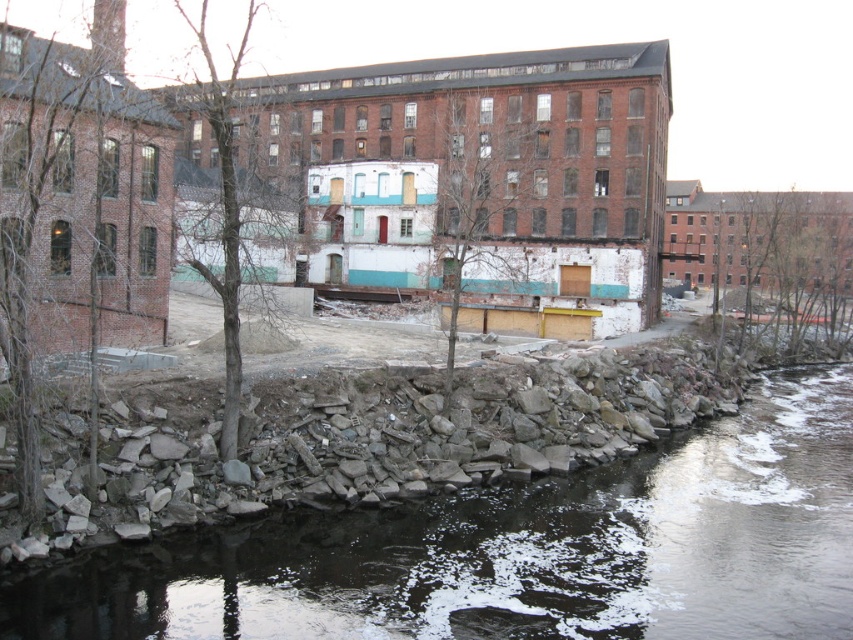
You are a city planner assessing the space in front of the brick building at center. There is a rocky concrete stream at lower left. Which one is wider?

The brick building at center is wider than the rocky concrete stream at lower left.

You are a city planner assessing the site for a new public garden. You see the rocky concrete stream at lower left and the brick building at center. Which of these two features occupies a larger area in the scene?

The brick building at center occupies a larger area than the rocky concrete stream at lower left, as the stream is described as having a smaller size compared to the building.